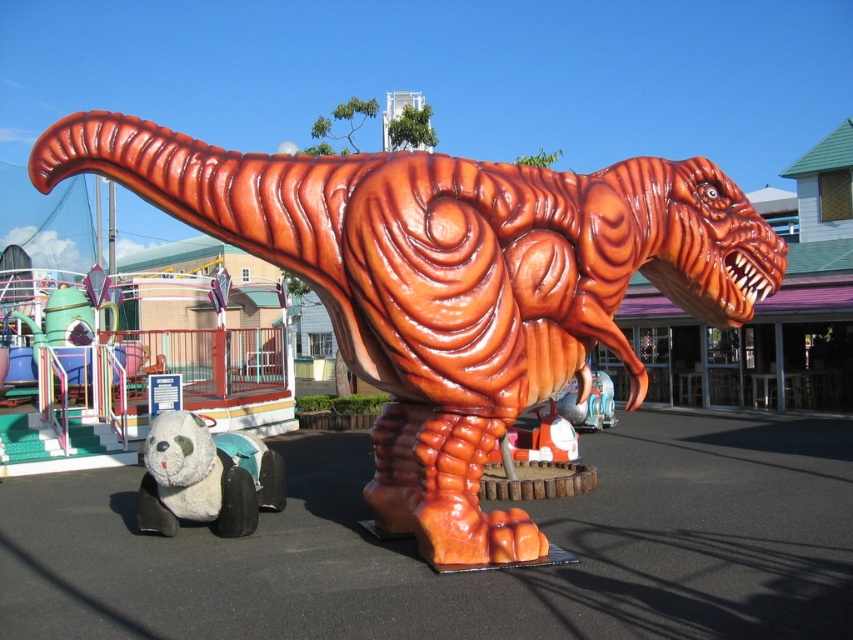
Looking at this image, you are a photographer setting up a wide shot of the amusement park scene. You need to include both the shiny orange dinosaur at center and the white plush panda at lower left in your frame. Based on their sizes, which object will occupy more space horizontally in your photograph?

The shiny orange dinosaur at center will occupy more space horizontally in the photograph because its width surpasses that of the white plush panda at lower left.

You are a visitor at the amusement park and want to take a photo of both the shiny orange dinosaur at center and the white plush panda at lower left. Can you see both objects in the same frame without moving your camera position?

The shiny orange dinosaur at center is in front of the white plush panda at lower left, so the dinosaur may block the view of the panda in the photo. You might not be able to see both in the same frame without moving your camera position.

You are a parent trying to locate your child who is holding a white plush panda at lower left. You are currently standing near the shiny orange dinosaur at center. Which direction should you look to find your child?

The shiny orange dinosaur at center is above the white plush panda at lower left, so you should look downward or toward the lower left direction to find the child holding the white plush panda at lower left.